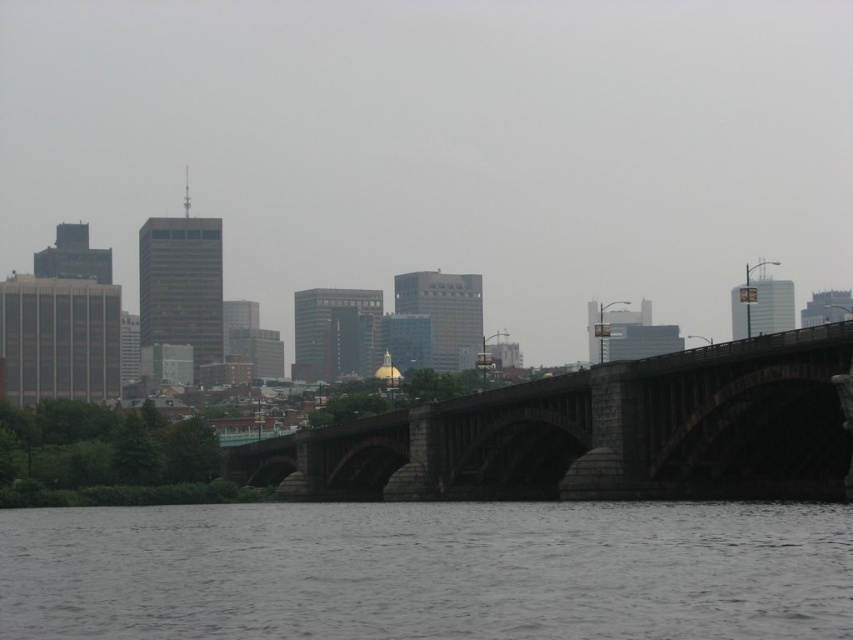
Question: Can you confirm if gray stone bridge at lower center is positioned to the left of dark gray stone bridge at center?

Choices:
 (A) yes
 (B) no

Answer: (A)

Question: Which point is farther to the camera?

Choices:
 (A) (508, 486)
 (B) (4, 577)

Answer: (A)

Question: Is gray stone bridge at lower center behind dark gray stone bridge at center?

Choices:
 (A) yes
 (B) no

Answer: (B)

Question: Can you confirm if gray stone bridge at lower center is bigger than dark gray stone bridge at center?

Choices:
 (A) yes
 (B) no

Answer: (B)